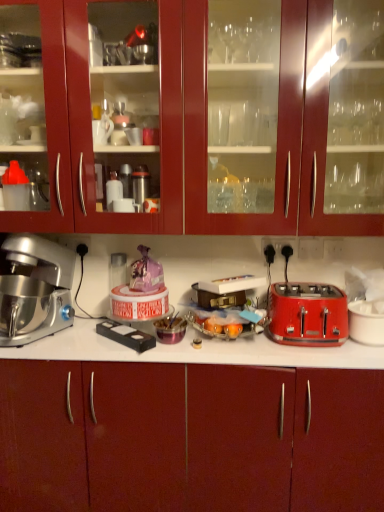
Find the location of a particular element. The height and width of the screenshot is (512, 384). vacant space in front of black plastic remote control at center is located at coordinates (119, 351).